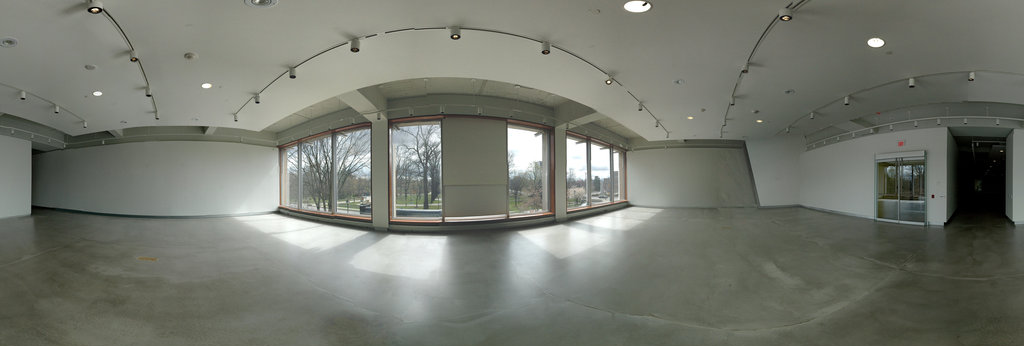
Find the location of a particular element. hallway is located at coordinates pyautogui.click(x=981, y=183).